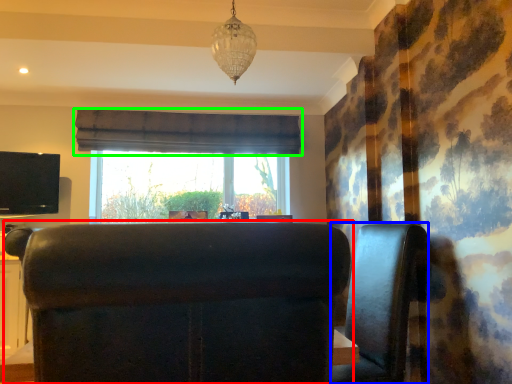
Question: Considering the real-world distances, which object is farthest from furniture (highlighted by a red box)? furniture (highlighted by a blue box) or curtain (highlighted by a green box)?

Choices:
 (A) furniture
 (B) curtain

Answer: (B)